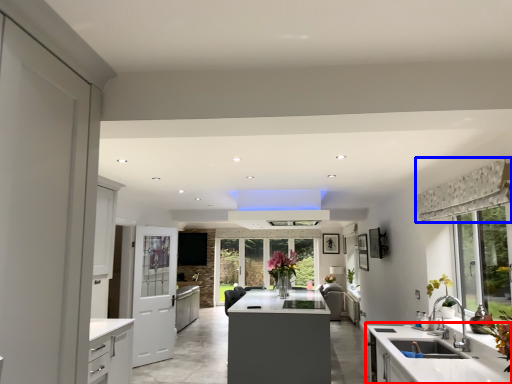
Question: Among these objects, which one is nearest to the camera, countertop (highlighted by a red box) or curtain (highlighted by a blue box)?

Choices:
 (A) countertop
 (B) curtain

Answer: (B)